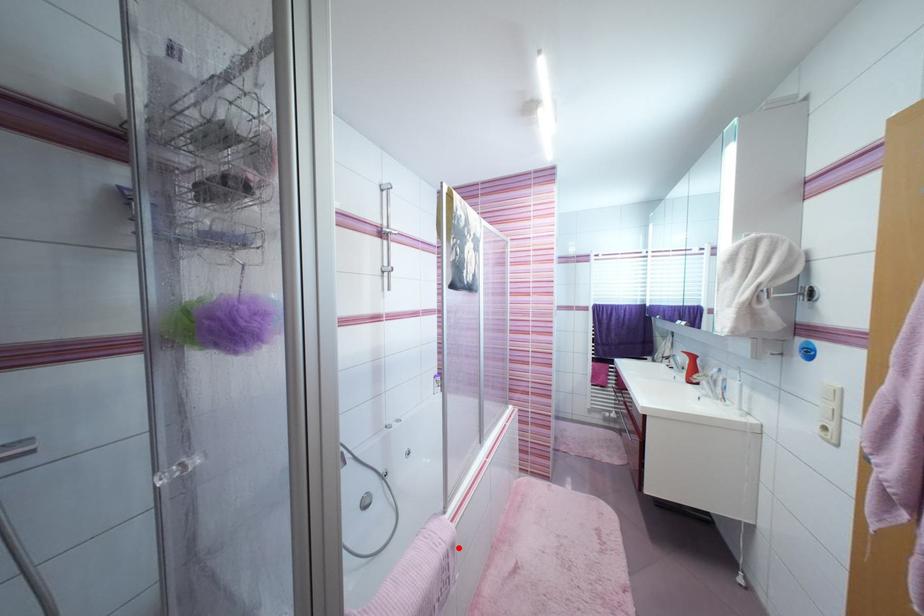
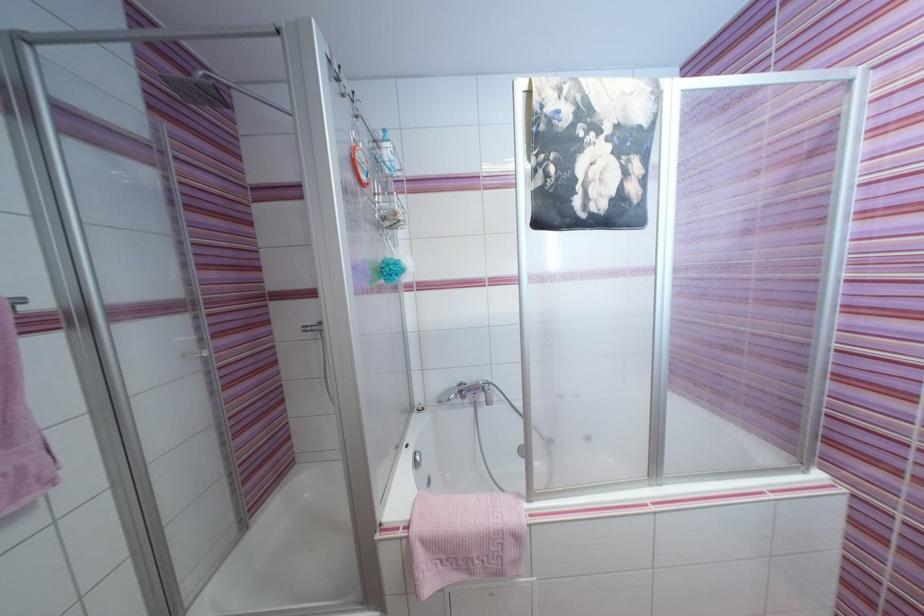
The point at the highlighted location is marked in the first image. Where is the corresponding point in the second image?

(521, 539)